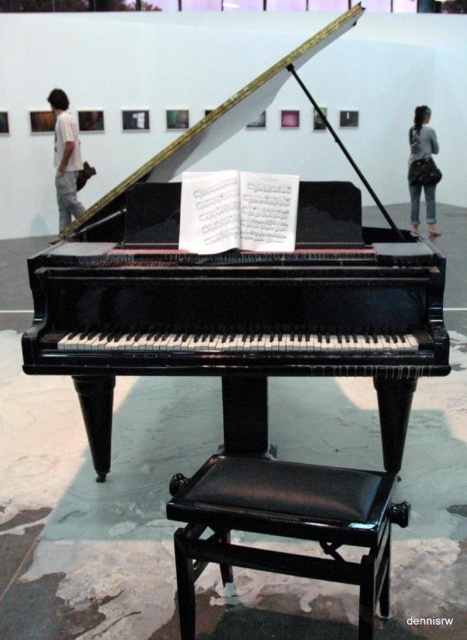
You are an interior designer planning to place a new sculpture in the art gallery. The sculpture requires a space that is at least 1 meter away from the glossy black piano at center to avoid damage. Based on the coordinates provided in the Objects Description, can you determine if the sculpture can be placed at point A located at coordinates 0.5, 0.5?

The glossy black piano at center is located at point (236, 292). The distance between the piano and point A at (233, 320) would need to be calculated. Since the coordinates are close, it is likely less than 1 meter. Therefore, placing the sculpture at point A might be too close to the piano, risking damage.